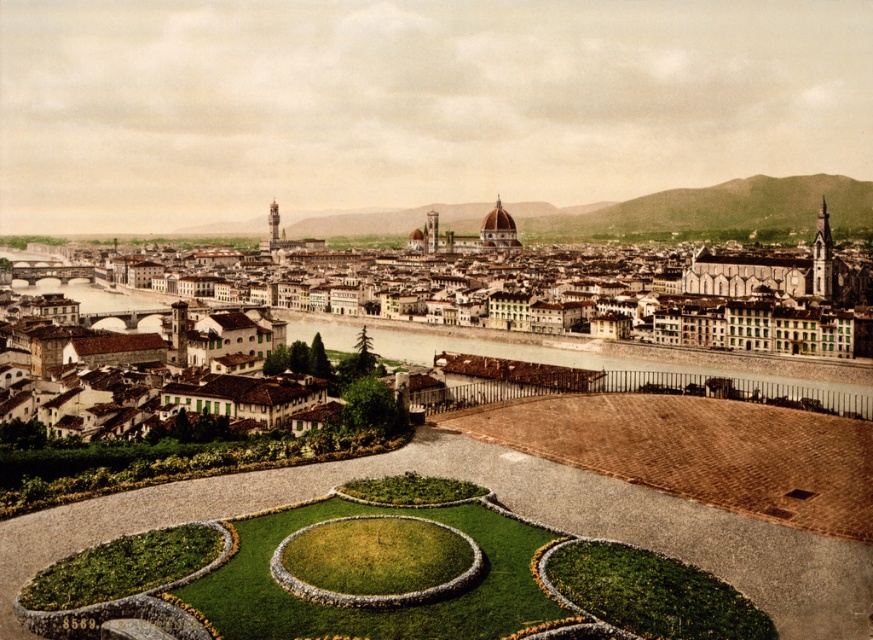
Measure the distance between point (285, 365) and camera.

Point (285, 365) and camera are 174.57 meters apart from each other.

Based on the photo, does brown stone buildings at center appear under brown concrete river at center?

Actually, brown stone buildings at center is above brown concrete river at center.

The image size is (873, 640). What do you see at coordinates (617, 323) in the screenshot?
I see `brown stone buildings at center` at bounding box center [617, 323].

Locate an element on the screen. The image size is (873, 640). brown stone buildings at center is located at coordinates (617, 323).